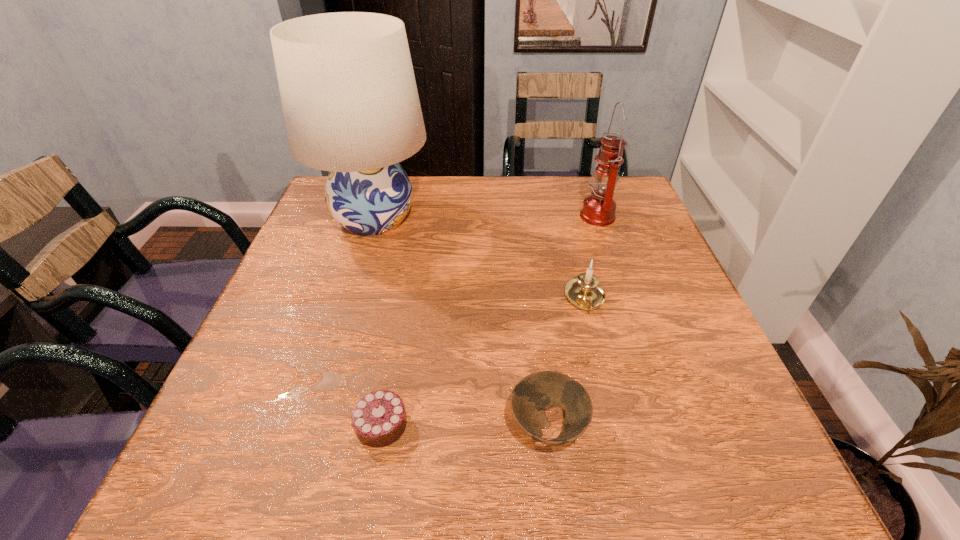
The height and width of the screenshot is (540, 960). I want to click on free space at the far edge of the desktop, so click(461, 189).

Find the location of `free space at the near edge of the desktop`. free space at the near edge of the desktop is located at coordinates (531, 479).

This screenshot has height=540, width=960. What are the coordinates of `vacant area at the left edge of the desktop` in the screenshot? It's located at (342, 263).

Find the location of a particular element. The width and height of the screenshot is (960, 540). free space at the right edge of the desktop is located at coordinates (645, 241).

This screenshot has height=540, width=960. In the image, there is a desktop. What are the coordinates of `vacant space at the near left corner` in the screenshot? It's located at (260, 476).

Identify the location of free point at the far right corner. Image resolution: width=960 pixels, height=540 pixels. (650, 221).

Find the location of `empty location between the chocolate cake and the tallest object`. empty location between the chocolate cake and the tallest object is located at coordinates (378, 321).

Locate an element on the screen. Image resolution: width=960 pixels, height=540 pixels. vacant region between the third tallest object and the oil lamp is located at coordinates (591, 257).

Where is `unoccupied position between the fourth tallest object and the shortest object`? This screenshot has height=540, width=960. unoccupied position between the fourth tallest object and the shortest object is located at coordinates (465, 425).

This screenshot has height=540, width=960. What are the coordinates of `free space between the tallest object and the chocolate cake` in the screenshot? It's located at (378, 321).